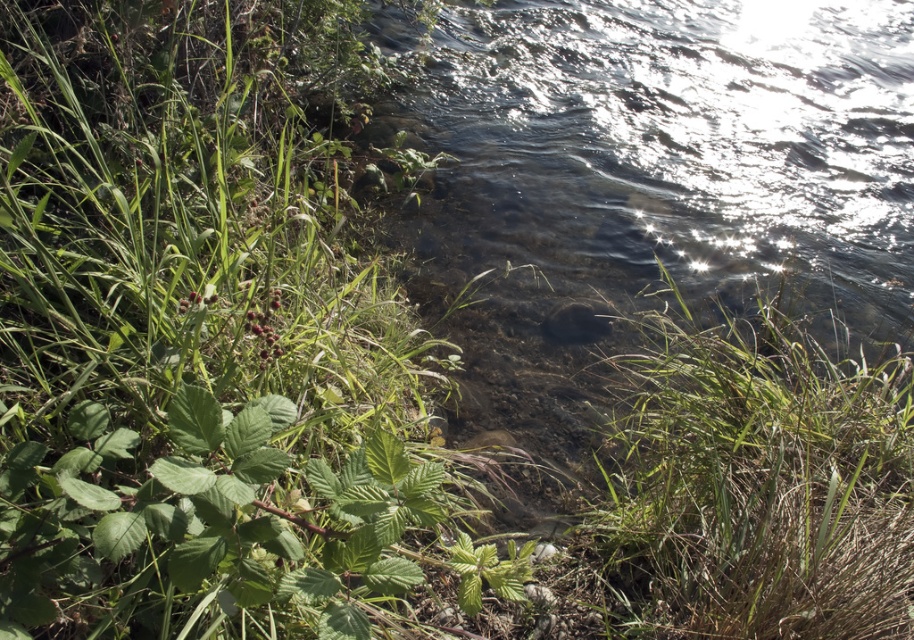
Question: Which point is farther to the camera?

Choices:
 (A) green leafy plant at left
 (B) green grass at lower right

Answer: (B)

Question: Does green leafy plant at left appear on the right side of green grass at lower right?

Choices:
 (A) yes
 (B) no

Answer: (B)

Question: Is green leafy plant at left closer to camera compared to green grass at lower right?

Choices:
 (A) no
 (B) yes

Answer: (B)

Question: Can you confirm if green leafy plant at left is bigger than green grass at lower right?

Choices:
 (A) no
 (B) yes

Answer: (B)

Question: Which of the following is the farthest from the observer?

Choices:
 (A) (82, 336)
 (B) (756, 496)

Answer: (B)